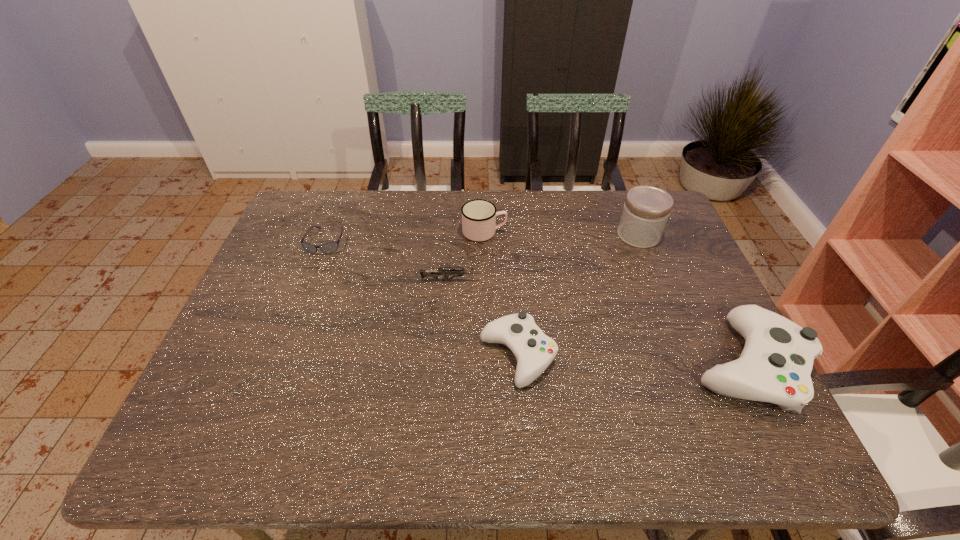
Locate an element on the screen. vacant point located between the gun and the jar is located at coordinates (544, 258).

Select which object appears as the fourth closest to the taller control. Please provide its 2D coordinates. Your answer should be formatted as a tuple, i.e. [(x, y)], where the tuple contains the x and y coordinates of a point satisfying the conditions above.

[(424, 273)]

Where is `object that ranks as the closest to the mug`? object that ranks as the closest to the mug is located at coordinates (424, 273).

Image resolution: width=960 pixels, height=540 pixels. What are the coordinates of `vacant space that satisfies the following two spatial constraints: 1. on the lenses of the third shortest object; 2. on the left side of the leftmost object` in the screenshot? It's located at (282, 356).

Locate an element on the screen. Image resolution: width=960 pixels, height=540 pixels. vacant space that satisfies the following two spatial constraints: 1. on the side of the mug with the handle; 2. on the lenses of the leftmost object is located at coordinates (485, 241).

Find the location of a particular element. The image size is (960, 540). free space in the image that satisfies the following two spatial constraints: 1. on the front side of the tallest object; 2. aimed along the barrel of the gun is located at coordinates (657, 280).

I want to click on vacant position in the image that satisfies the following two spatial constraints: 1. on the back side of the left control; 2. aimed along the barrel of the fourth farthest object, so click(x=513, y=280).

The height and width of the screenshot is (540, 960). Identify the location of free location that satisfies the following two spatial constraints: 1. aimed along the barrel of the second shortest object; 2. on the back side of the right control. (445, 364).

The image size is (960, 540). What are the coordinates of `free spot that satisfies the following two spatial constraints: 1. on the lenses of the sunglasses; 2. on the left side of the fourth tallest object` in the screenshot? It's located at (282, 356).